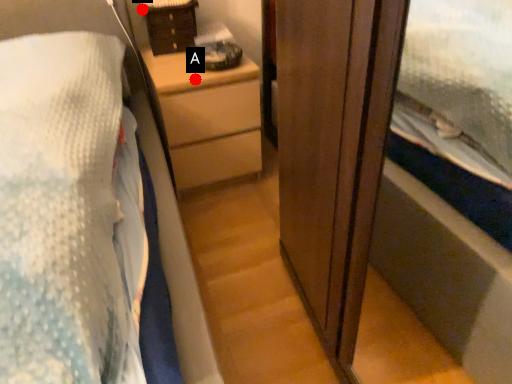
Question: Two points are circled on the image, labeled by A and B beside each circle. Among these points, which one is nearest to the camera?

Choices:
 (A) A is closer
 (B) B is closer

Answer: (A)